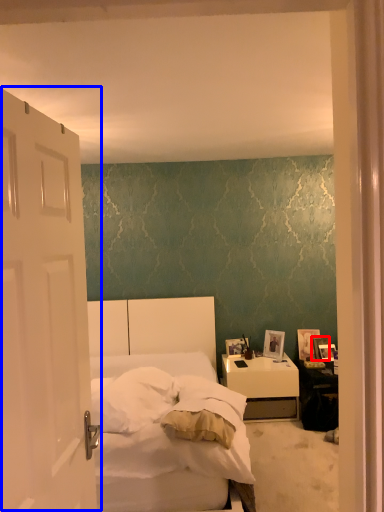
Question: Which object appears closest to the camera in this image, picture frame (highlighted by a red box) or door (highlighted by a blue box)?

Choices:
 (A) picture frame
 (B) door

Answer: (B)